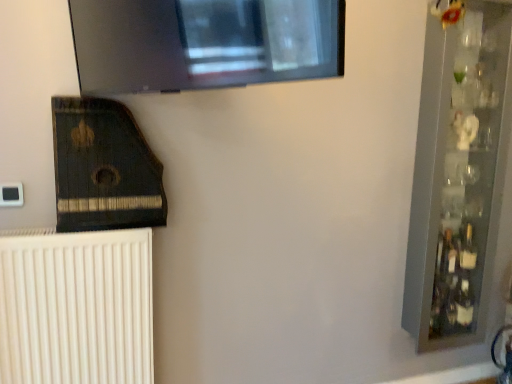
Question: Considering the relative positions of white ribbed radiator at lower left and clear glass shelf at right in the image provided, is white ribbed radiator at lower left to the left or to the right of clear glass shelf at right?

Choices:
 (A) left
 (B) right

Answer: (A)

Question: From the image's perspective, is white ribbed radiator at lower left above or below clear glass shelf at right?

Choices:
 (A) below
 (B) above

Answer: (A)

Question: Considering the real-world distances, which object is closest to the white ribbed radiator at lower left?

Choices:
 (A) clear glass shelf at right
 (B) dark wood harp at lower left
 (C) clear glass bottle at right

Answer: (B)

Question: Estimate the real-world distances between objects in this image. Which object is closer to the white ribbed radiator at lower left?

Choices:
 (A) dark wood harp at lower left
 (B) clear glass bottle at right
 (C) clear glass shelf at right

Answer: (A)